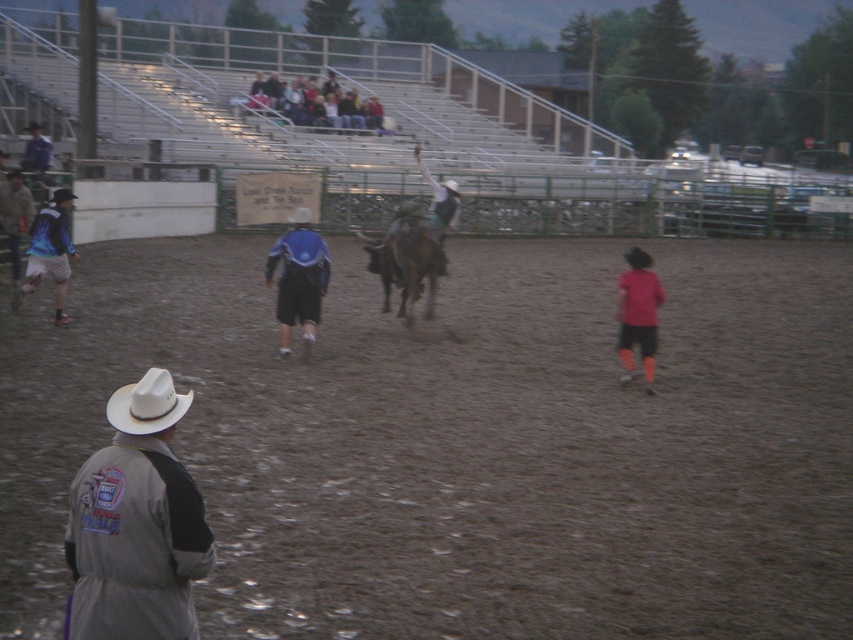
Can you confirm if blue fabric jacket at center is smaller than red matte shirt at right?

No.

Is blue fabric jacket at center in front of red matte shirt at right?

No, it is behind red matte shirt at right.

The height and width of the screenshot is (640, 853). In order to click on blue fabric jacket at center in this screenshot , I will do `click(299, 280)`.

Is light gray fabric jacket at lower left closer to the viewer compared to blue denim jeans at upper center?

That is True.

Who is positioned more to the right, light gray fabric jacket at lower left or blue denim jeans at upper center?

From the viewer's perspective, light gray fabric jacket at lower left appears more on the right side.

The image size is (853, 640). What do you see at coordinates (136, 524) in the screenshot?
I see `light gray fabric jacket at lower left` at bounding box center [136, 524].

Find the location of a particular element. This screenshot has height=640, width=853. light gray fabric jacket at lower left is located at coordinates (136, 524).

Does point (300, 88) come closer to viewer compared to point (646, 317)?

No, (300, 88) is further to viewer.

Is blue denim jeans at upper center above red matte shirt at right?

Yes.

Does point (331, 97) come behind point (643, 260)?

Yes.

Locate an element on the screen. Image resolution: width=853 pixels, height=640 pixels. blue denim jeans at upper center is located at coordinates click(317, 102).